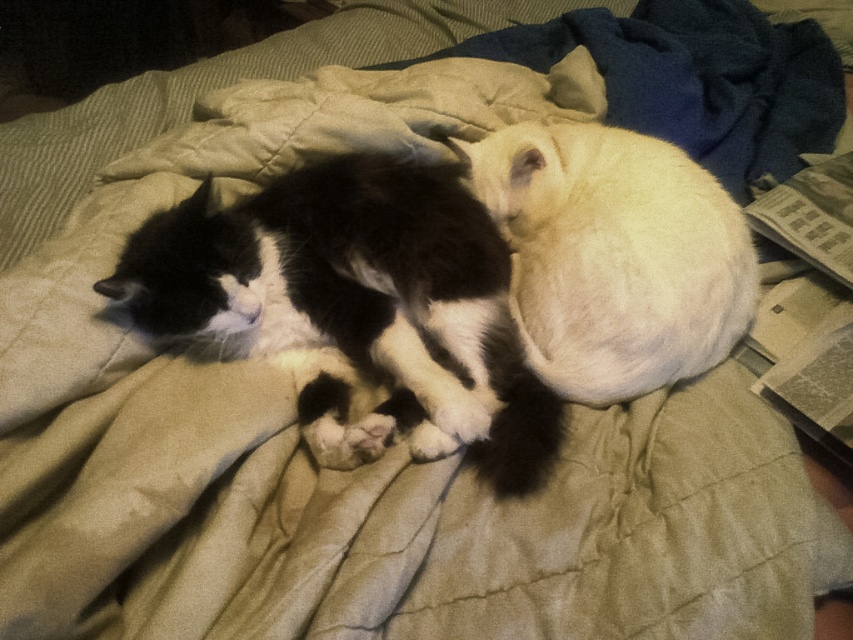
You are a photographer taking a picture of the two cats on the bed. You want to ensure both cats are in the frame. Since the black and white fur cat at center is to the left of the white fluffy cat at center, which cat should you adjust your camera to focus on first to capture both?

You should focus on the black and white fur cat at center first since it is positioned to the left of the white fluffy cat at center, ensuring both are within the frame.

Consider the image. You are a photographer trying to capture a closeup of the black and white cat on the bed. You notice two points marked on your screen at coordinates point (552, 433) and point (647, 310). Which point should you focus on to get the best closeup of the black and white cat?

Point (552, 433) is closer to the viewer than point (647, 310), so focusing on point (552, 433) would provide a better closeup of the black and white cat since it is nearer.

You are a veterinarian examining two cats on a bed. The cats are the black and white fur cat at center and the white fluffy cat at center. Which cat would you need to handle with more care due to its size?

The black and white fur cat at center is bigger than the white fluffy cat at center, so it requires more careful handling due to its larger size.